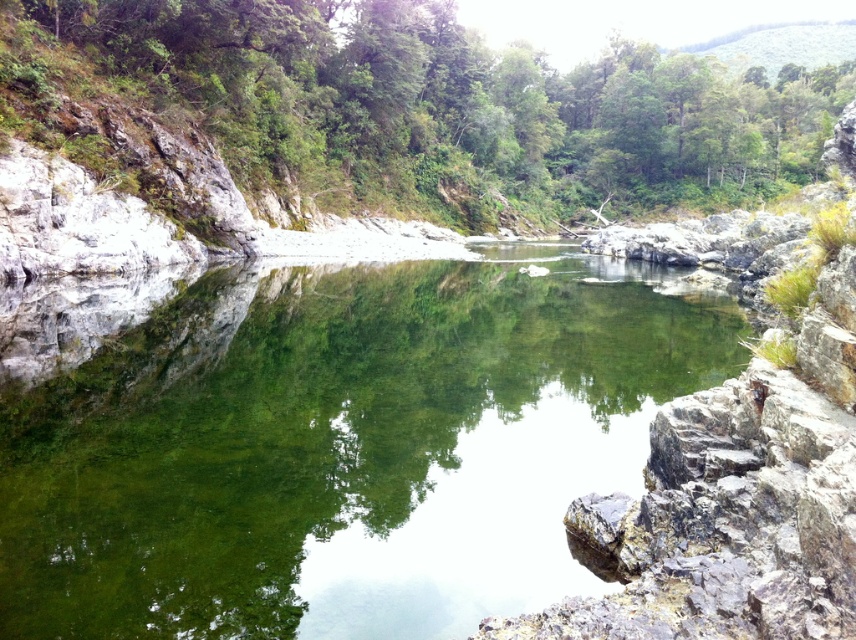
Question: Among these objects, which one is farthest from the camera?

Choices:
 (A) green leafy tree at center
 (B) clear glassy water at center

Answer: (A)

Question: Is clear glassy water at center to the right of green leafy tree at center from the viewer's perspective?

Choices:
 (A) yes
 (B) no

Answer: (B)

Question: Where is clear glassy water at center located in relation to green leafy tree at center in the image?

Choices:
 (A) left
 (B) right

Answer: (A)

Question: Which of the following is the farthest from the observer?

Choices:
 (A) (3, 33)
 (B) (502, 388)

Answer: (A)

Question: Which point appears closest to the camera in this image?

Choices:
 (A) (375, 76)
 (B) (525, 371)

Answer: (B)

Question: In this image, where is clear glassy water at center located relative to green leafy tree at center?

Choices:
 (A) right
 (B) left

Answer: (B)